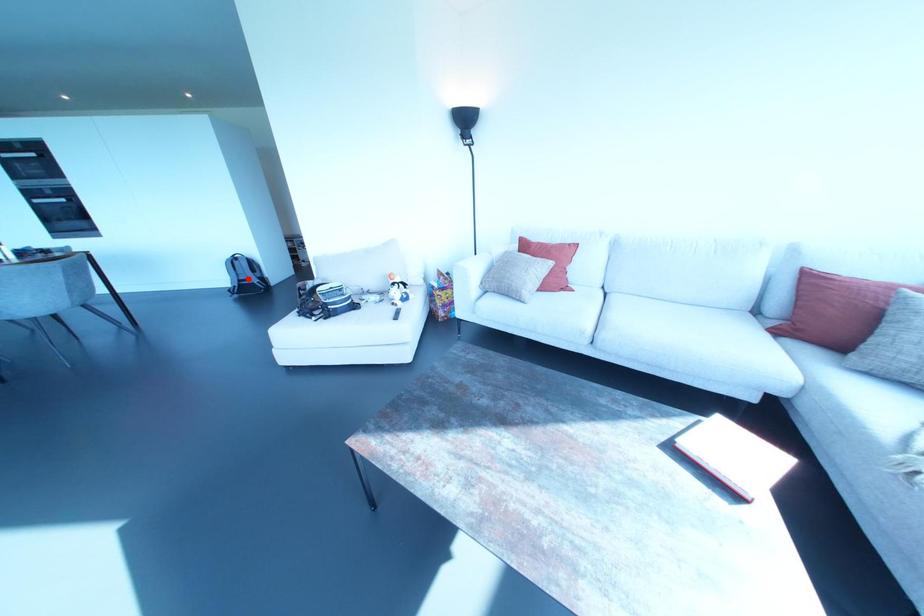
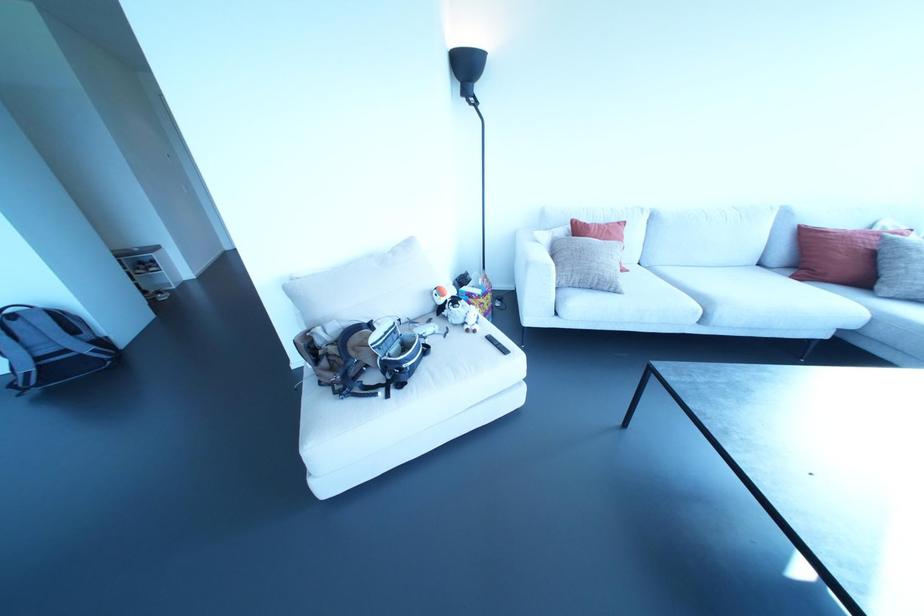
Where in the second image is the point corresponding to the highlighted location from the first image?

(65, 350)